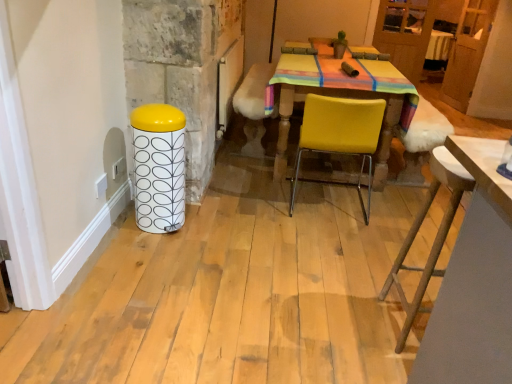
Where is `vacant area that lies between wooden table at lower right and yellow matte chair at center`? vacant area that lies between wooden table at lower right and yellow matte chair at center is located at coordinates (350, 252).